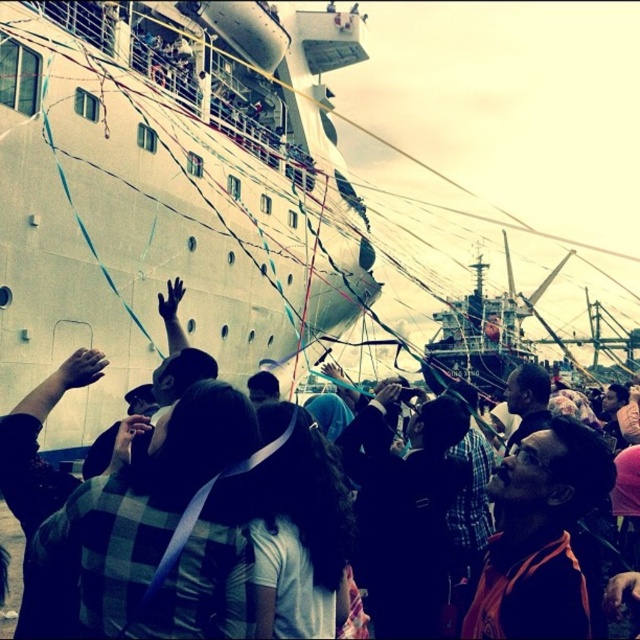
You are standing at the dockside event and want to take a photo of the white matte ship at upper left without the black fabric crowd at lower center blocking the view. Is the ship positioned in a way that allows this?

The white matte ship at upper left is positioned over the black fabric crowd at lower center, so if you stand at a higher elevation or angle your camera upwards, you can capture the ship without the crowd blocking the view.

Looking at this image, you are standing at the point closer to the camera in the scene. Which point are you at, point (x=280, y=32) or point (x=509, y=403)?

You are at point (x=280, y=32) because it is closer to the camera than point (x=509, y=403).